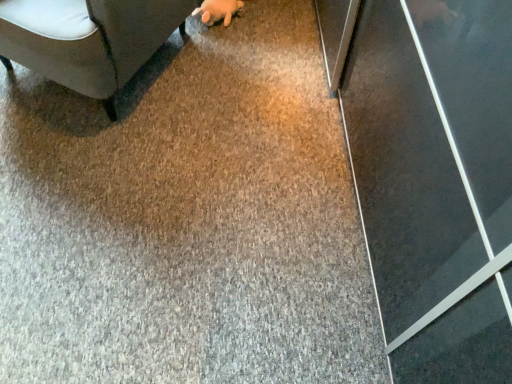
Question: Is fuzzy beige hand at upper center outside of dark gray fabric couch at upper left?

Choices:
 (A) no
 (B) yes

Answer: (A)

Question: Are fuzzy beige hand at upper center and dark gray fabric couch at upper left beside each other?

Choices:
 (A) yes
 (B) no

Answer: (B)

Question: Is fuzzy beige hand at upper center closer to camera compared to dark gray fabric couch at upper left?

Choices:
 (A) yes
 (B) no

Answer: (B)

Question: Is fuzzy beige hand at upper center aimed at dark gray fabric couch at upper left?

Choices:
 (A) yes
 (B) no

Answer: (A)

Question: Does fuzzy beige hand at upper center have a smaller size compared to dark gray fabric couch at upper left?

Choices:
 (A) yes
 (B) no

Answer: (A)

Question: Would you consider fuzzy beige hand at upper center to be distant from dark gray fabric couch at upper left?

Choices:
 (A) yes
 (B) no

Answer: (B)

Question: Considering the relative positions of dark gray fabric couch at upper left and fuzzy beige hand at upper center in the image provided, is dark gray fabric couch at upper left to the right of fuzzy beige hand at upper center from the viewer's perspective?

Choices:
 (A) yes
 (B) no

Answer: (B)

Question: Can you confirm if dark gray fabric couch at upper left is taller than fuzzy beige hand at upper center?

Choices:
 (A) yes
 (B) no

Answer: (A)

Question: Is fuzzy beige hand at upper center located within dark gray fabric couch at upper left?

Choices:
 (A) no
 (B) yes

Answer: (B)

Question: Does dark gray fabric couch at upper left turn towards fuzzy beige hand at upper center?

Choices:
 (A) no
 (B) yes

Answer: (A)

Question: Can you confirm if dark gray fabric couch at upper left is smaller than fuzzy beige hand at upper center?

Choices:
 (A) yes
 (B) no

Answer: (B)

Question: Is dark gray fabric couch at upper left looking in the opposite direction of fuzzy beige hand at upper center?

Choices:
 (A) no
 (B) yes

Answer: (B)

Question: Is dark gray fabric couch at upper left wider or thinner than fuzzy beige hand at upper center?

Choices:
 (A) wide
 (B) thin

Answer: (A)